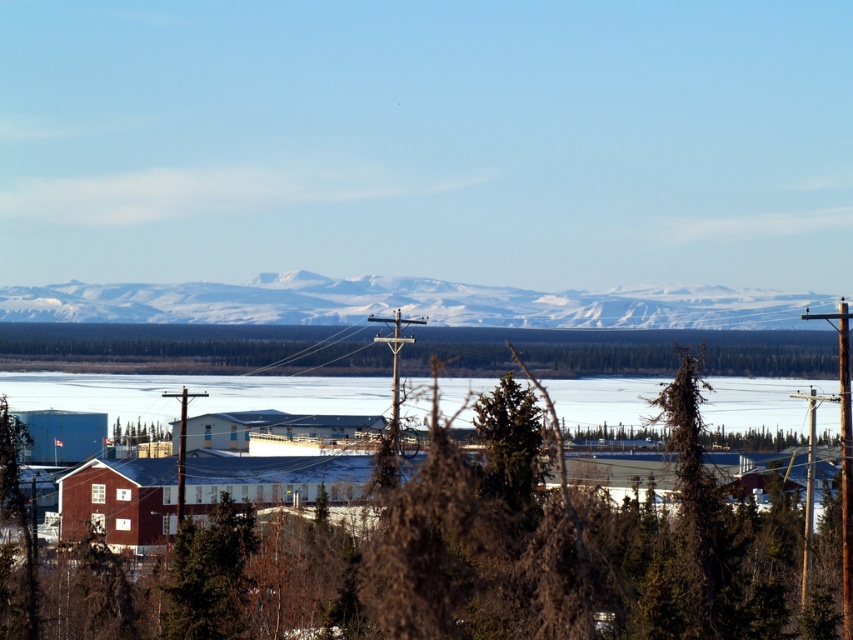
Question: Based on their relative distances, which object is nearer to the green matte tree at center?

Choices:
 (A) white snow-covered mountain range at upper center
 (B) brown textured tree at center

Answer: (B)

Question: Is white snow-covered mountain range at upper center smaller than green matte tree at center?

Choices:
 (A) no
 (B) yes

Answer: (A)

Question: Can you confirm if brown textured tree at center is bigger than white snow-covered mountain range at upper center?

Choices:
 (A) no
 (B) yes

Answer: (A)

Question: Based on their relative distances, which object is nearer to the green matte tree at center?

Choices:
 (A) brown textured tree at center
 (B) white snow-covered mountain range at upper center

Answer: (A)

Question: Is brown textured tree at center thinner than green matte tree at center?

Choices:
 (A) yes
 (B) no

Answer: (B)

Question: Which of these objects is positioned farthest from the brown textured tree at center?

Choices:
 (A) green matte tree at center
 (B) white snow-covered mountain range at upper center

Answer: (B)